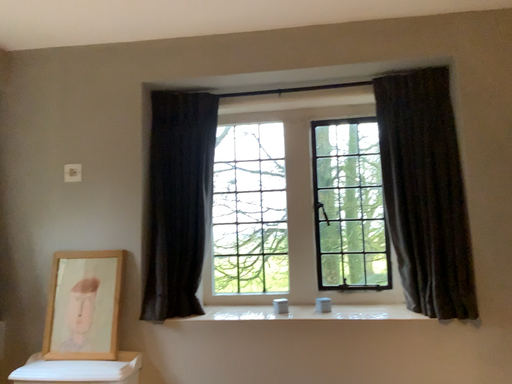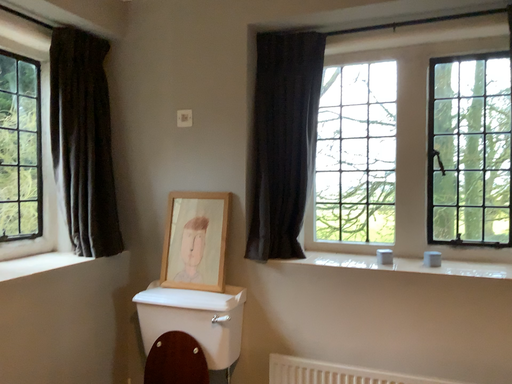
Question: How did the camera likely rotate when shooting the video?

Choices:
 (A) rotated upward
 (B) rotated downward

Answer: (B)